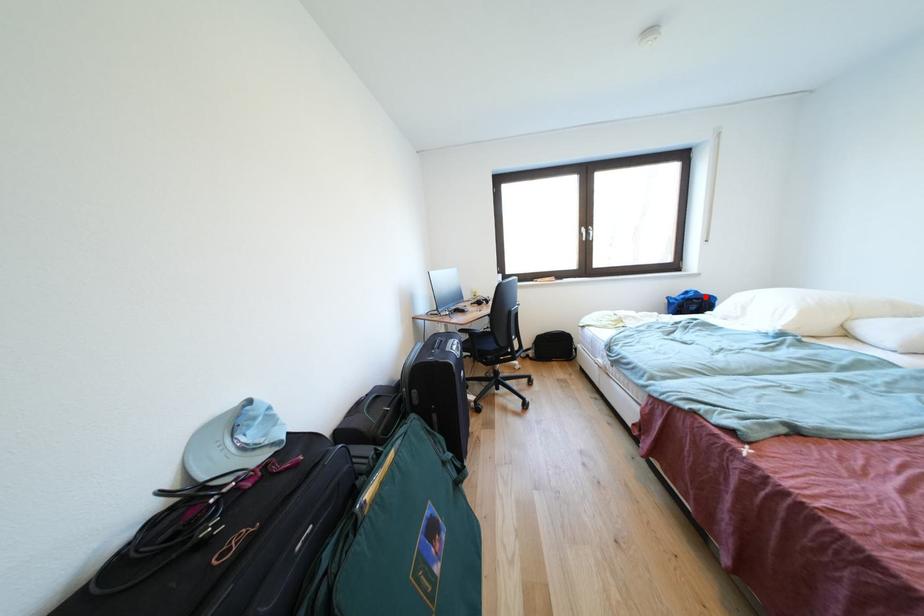
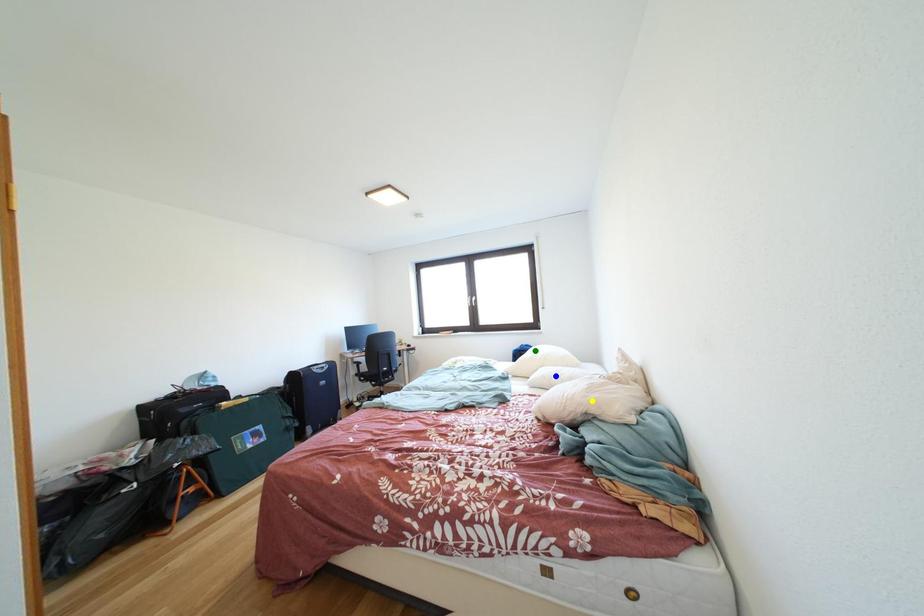
Question: I am providing you with two images of the same scene from different viewpoints. A red point is marked on the first image. You are given multiple points on the second image. In image 2, which mark is for the same physical point as the one in image 1?

Choices:
 (A) yellow point
 (B) green point
 (C) blue point

Answer: (B)